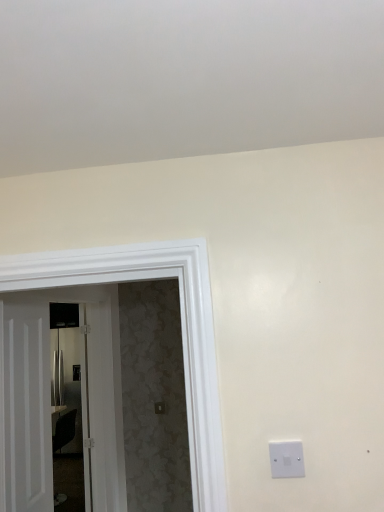
Question: From the image's perspective, is white glossy door at left, which appears as the first door when viewed from the right, above white wooden door at left, arranged as the first door when viewed from the left?

Choices:
 (A) yes
 (B) no

Answer: (B)

Question: Is white glossy door at left, which appears as the first door when viewed from the right, at the right side of white wooden door at left, the second door viewed from the right?

Choices:
 (A) yes
 (B) no

Answer: (A)

Question: Is white glossy door at left, which appears as the first door when viewed from the right, located outside white wooden door at left, arranged as the first door when viewed from the left?

Choices:
 (A) yes
 (B) no

Answer: (A)

Question: Can you confirm if white glossy door at left, which appears as the first door when viewed from the right, is thinner than white wooden door at left, the second door viewed from the right?

Choices:
 (A) no
 (B) yes

Answer: (A)

Question: From the image's perspective, is white glossy door at left, which appears as the first door when viewed from the right, beneath white wooden door at left, the second door viewed from the right?

Choices:
 (A) yes
 (B) no

Answer: (A)

Question: In terms of size, does white plastic light switch at lower right appear bigger or smaller than metallic silver refrigerator at left?

Choices:
 (A) big
 (B) small

Answer: (B)

Question: In the image, is white plastic light switch at lower right positioned in front of or behind metallic silver refrigerator at left?

Choices:
 (A) behind
 (B) front

Answer: (B)

Question: Is white plastic light switch at lower right wider or thinner than metallic silver refrigerator at left?

Choices:
 (A) wide
 (B) thin

Answer: (B)

Question: From their relative heights in the image, would you say white plastic light switch at lower right is taller or shorter than metallic silver refrigerator at left?

Choices:
 (A) tall
 (B) short

Answer: (B)

Question: From the image's perspective, is metallic silver refrigerator at left above or below white plastic light switch at lower right?

Choices:
 (A) below
 (B) above

Answer: (A)

Question: From their relative heights in the image, would you say metallic silver refrigerator at left is taller or shorter than white plastic light switch at lower right?

Choices:
 (A) tall
 (B) short

Answer: (A)

Question: Is metallic silver refrigerator at left spatially inside white plastic light switch at lower right, or outside of it?

Choices:
 (A) outside
 (B) inside

Answer: (A)

Question: Does point (61, 435) appear closer or farther from the camera than point (273, 452)?

Choices:
 (A) closer
 (B) farther

Answer: (B)

Question: From the image's perspective, is white wooden door at left, the second door viewed from the right, located above or below metallic silver refrigerator at left?

Choices:
 (A) below
 (B) above

Answer: (B)

Question: In the image, is white wooden door at left, the second door viewed from the right, positioned in front of or behind metallic silver refrigerator at left?

Choices:
 (A) front
 (B) behind

Answer: (A)